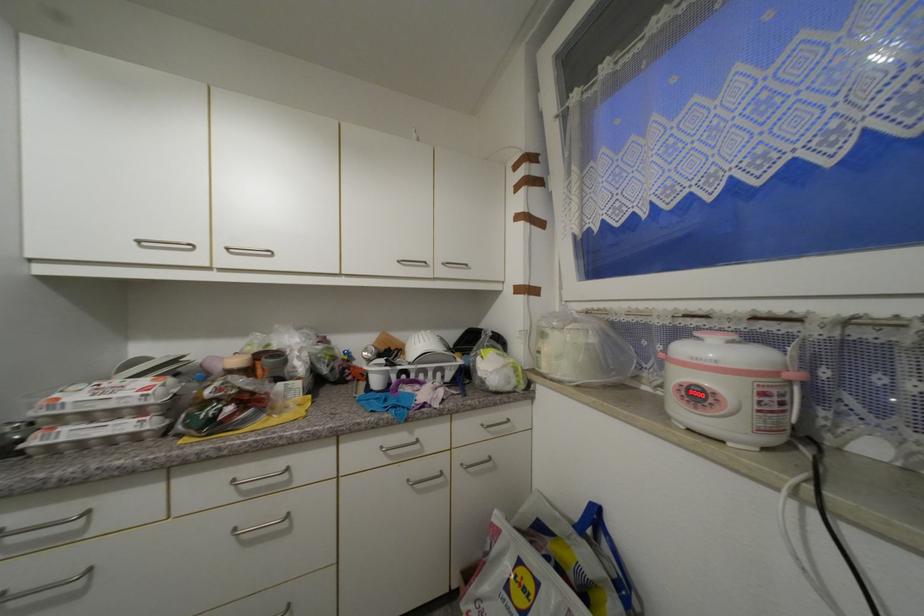
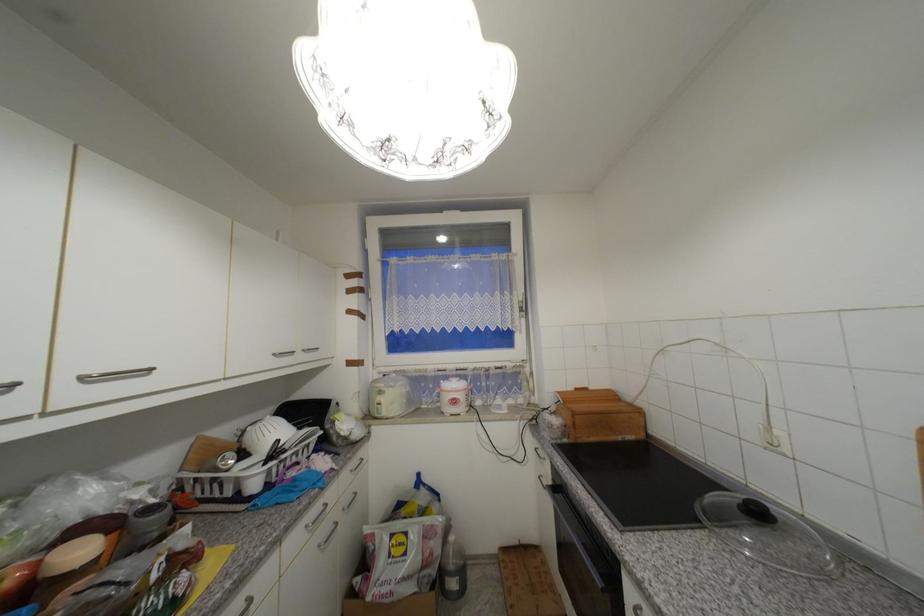
Find the pixel in the second image that matches (549,336) in the first image.

(386, 394)